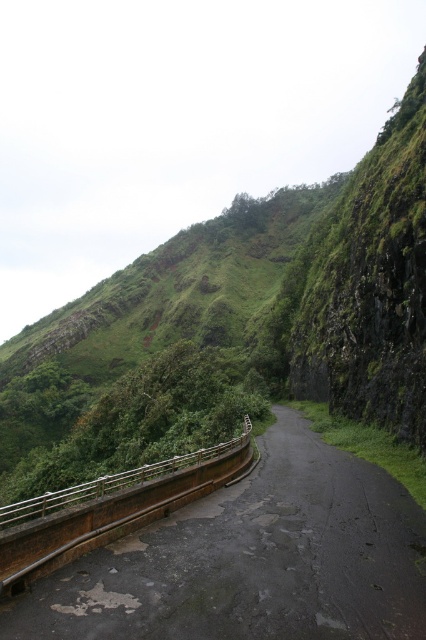
Find the location of a particular element. This screenshot has height=640, width=426. dark asphalt road at center is located at coordinates (253, 560).

Is point (172, 611) positioned in front of point (224, 449)?

Yes, it is in front of point (224, 449).

This screenshot has height=640, width=426. In order to click on dark asphalt road at center in this screenshot , I will do `click(253, 560)`.

This screenshot has height=640, width=426. In order to click on dark asphalt road at center in this screenshot , I will do `click(253, 560)`.